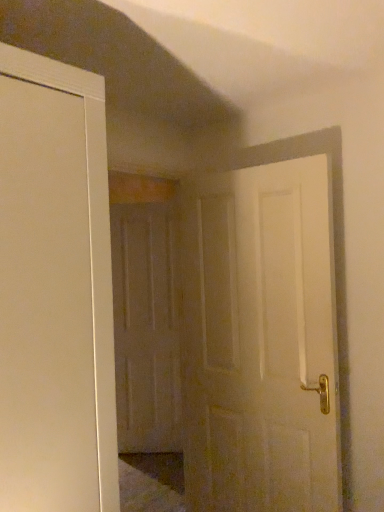
Image resolution: width=384 pixels, height=512 pixels. Identify the location of matte wooden door at center, which is the second door from right to left. (146, 328).

What do you see at coordinates (146, 328) in the screenshot? I see `matte wooden door at center, acting as the 2th door starting from the front` at bounding box center [146, 328].

Measure the distance between white matte door at center, positioned as the 2th door in back-to-front order, and camera.

5.89 feet.

Image resolution: width=384 pixels, height=512 pixels. What do you see at coordinates (260, 341) in the screenshot?
I see `white matte door at center, the 1th door viewed from the front` at bounding box center [260, 341].

Find the location of a particular element. white matte door at center, positioned as the 2th door in back-to-front order is located at coordinates (260, 341).

Find the location of a particular element. The image size is (384, 512). matte wooden door at center, which is the second door from right to left is located at coordinates (146, 328).

Can you confirm if white matte door at center, which ranks as the first door in right-to-left order, is positioned to the left of matte wooden door at center, which is counted as the 1th door, starting from the back?

No.

Which is in front, white matte door at center, the 1th door viewed from the front, or matte wooden door at center, acting as the 2th door starting from the front?

white matte door at center, the 1th door viewed from the front, is closer to the camera.

Considering the points (242, 481) and (165, 397), which point is behind, point (242, 481) or point (165, 397)?

The point (165, 397) is behind.

From the image's perspective, is white matte door at center, the 1th door viewed from the front, over matte wooden door at center, acting as the 2th door starting from the front?

Yes, from the image's perspective, white matte door at center, the 1th door viewed from the front, is above matte wooden door at center, acting as the 2th door starting from the front.

From a real-world perspective, is white matte door at center, which ranks as the first door in right-to-left order, positioned above or below matte wooden door at center, which is the second door from right to left?

From a real-world perspective, white matte door at center, which ranks as the first door in right-to-left order, is physically above matte wooden door at center, which is the second door from right to left.

Does white matte door at center, the 1th door viewed from the front, have a lesser width compared to matte wooden door at center, which is the second door from right to left?

Incorrect, the width of white matte door at center, the 1th door viewed from the front, is not less than that of matte wooden door at center, which is the second door from right to left.

Does white matte door at center, positioned as the 2th door in back-to-front order, have a greater height compared to matte wooden door at center, which is counted as the 1th door, starting from the back?

Incorrect, the height of white matte door at center, positioned as the 2th door in back-to-front order, is not larger of that of matte wooden door at center, which is counted as the 1th door, starting from the back.

Can you confirm if white matte door at center, which ranks as the first door in right-to-left order, is bigger than matte wooden door at center, placed as the 1th door when sorted from left to right?

Yes.

Would you say white matte door at center, placed as the 2th door when sorted from left to right, is inside or outside matte wooden door at center, acting as the 2th door starting from the front?

white matte door at center, placed as the 2th door when sorted from left to right, is located beyond the bounds of matte wooden door at center, acting as the 2th door starting from the front.

Based on the photo, would you consider white matte door at center, placed as the 2th door when sorted from left to right, to be distant from matte wooden door at center, acting as the 2th door starting from the front?

Yes.

Does white matte door at center, positioned as the 2th door in back-to-front order, turn towards matte wooden door at center, placed as the 1th door when sorted from left to right?

No, white matte door at center, positioned as the 2th door in back-to-front order, is not facing towards matte wooden door at center, placed as the 1th door when sorted from left to right.

This screenshot has width=384, height=512. Identify the location of door above the matte wooden door at center, which is counted as the 1th door, starting from the back (from a real-world perspective). (260, 341).

Between matte wooden door at center, which is counted as the 1th door, starting from the back, and white matte door at center, placed as the 2th door when sorted from left to right, which one appears on the left side from the viewer's perspective?

Positioned to the left is matte wooden door at center, which is counted as the 1th door, starting from the back.

Is matte wooden door at center, which is counted as the 1th door, starting from the back, in front of or behind white matte door at center, positioned as the 2th door in back-to-front order, in the image?

matte wooden door at center, which is counted as the 1th door, starting from the back, is positioned farther from the viewer than white matte door at center, positioned as the 2th door in back-to-front order.

Between point (169, 273) and point (266, 379), which one is positioned in front?

The point (266, 379) is in front.

From the image's perspective, is matte wooden door at center, which is counted as the 1th door, starting from the back, beneath white matte door at center, which ranks as the first door in right-to-left order?

Correct, matte wooden door at center, which is counted as the 1th door, starting from the back, appears lower than white matte door at center, which ranks as the first door in right-to-left order, in the image.

From a real-world perspective, is matte wooden door at center, which is the second door from right to left, located beneath white matte door at center, positioned as the 2th door in back-to-front order?

Yes, from a real-world perspective, matte wooden door at center, which is the second door from right to left, is below white matte door at center, positioned as the 2th door in back-to-front order.

Considering the relative sizes of matte wooden door at center, placed as the 1th door when sorted from left to right, and white matte door at center, positioned as the 2th door in back-to-front order, in the image provided, is matte wooden door at center, placed as the 1th door when sorted from left to right, thinner than white matte door at center, positioned as the 2th door in back-to-front order,?

Correct, the width of matte wooden door at center, placed as the 1th door when sorted from left to right, is less than that of white matte door at center, positioned as the 2th door in back-to-front order.

Can you confirm if matte wooden door at center, placed as the 1th door when sorted from left to right, is shorter than white matte door at center, positioned as the 2th door in back-to-front order?

No, matte wooden door at center, placed as the 1th door when sorted from left to right, is not shorter than white matte door at center, positioned as the 2th door in back-to-front order.

Can you confirm if matte wooden door at center, which is the second door from right to left, is smaller than white matte door at center, placed as the 2th door when sorted from left to right?

Correct, matte wooden door at center, which is the second door from right to left, occupies less space than white matte door at center, placed as the 2th door when sorted from left to right.

Looking at this image, is matte wooden door at center, acting as the 2th door starting from the front, situated inside white matte door at center, positioned as the 2th door in back-to-front order, or outside?

matte wooden door at center, acting as the 2th door starting from the front, cannot be found inside white matte door at center, positioned as the 2th door in back-to-front order.

Is matte wooden door at center, acting as the 2th door starting from the front, placed right next to white matte door at center, which ranks as the first door in right-to-left order?

There is a gap between matte wooden door at center, acting as the 2th door starting from the front, and white matte door at center, which ranks as the first door in right-to-left order.

Is matte wooden door at center, acting as the 2th door starting from the front, positioned with its back to white matte door at center, which ranks as the first door in right-to-left order?

That's not correct — matte wooden door at center, acting as the 2th door starting from the front, is not looking away from white matte door at center, which ranks as the first door in right-to-left order.

Where is `door on the left of white matte door at center, positioned as the 2th door in back-to-front order`? The height and width of the screenshot is (512, 384). door on the left of white matte door at center, positioned as the 2th door in back-to-front order is located at coordinates (146, 328).

In order to click on door on the left side of white matte door at center, the 1th door viewed from the front in this screenshot , I will do `click(146, 328)`.

Image resolution: width=384 pixels, height=512 pixels. In order to click on door behind the white matte door at center, placed as the 2th door when sorted from left to right in this screenshot , I will do `click(146, 328)`.